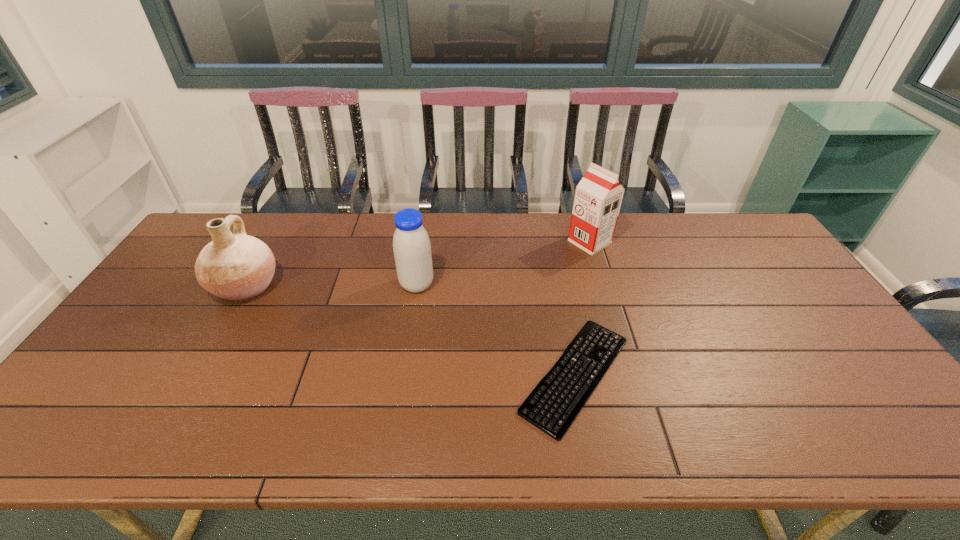
Locate an element on the screen. This screenshot has width=960, height=540. the right soya milk is located at coordinates (598, 197).

Identify the location of the farthest object. The width and height of the screenshot is (960, 540). (598, 197).

At what (x,y) coordinates should I click in order to perform the action: click on the third object from right to left. Please return your answer as a coordinate pair (x, y). Image resolution: width=960 pixels, height=540 pixels. Looking at the image, I should click on (411, 245).

The width and height of the screenshot is (960, 540). What are the coordinates of `the left soya milk` in the screenshot? It's located at 411,245.

In order to click on the leftmost object in this screenshot , I will do `click(237, 267)`.

Find the location of `the shortest object`. the shortest object is located at coordinates (553, 405).

This screenshot has height=540, width=960. I want to click on the nearest object, so click(553, 405).

This screenshot has width=960, height=540. I want to click on vacant area situated on the front of the farthest object, so click(x=601, y=278).

Where is `free region located on the right of the left soya milk`? This screenshot has height=540, width=960. free region located on the right of the left soya milk is located at coordinates click(507, 285).

The height and width of the screenshot is (540, 960). What are the coordinates of `vacant space situated to pour from the handle of the pottery` in the screenshot? It's located at (333, 286).